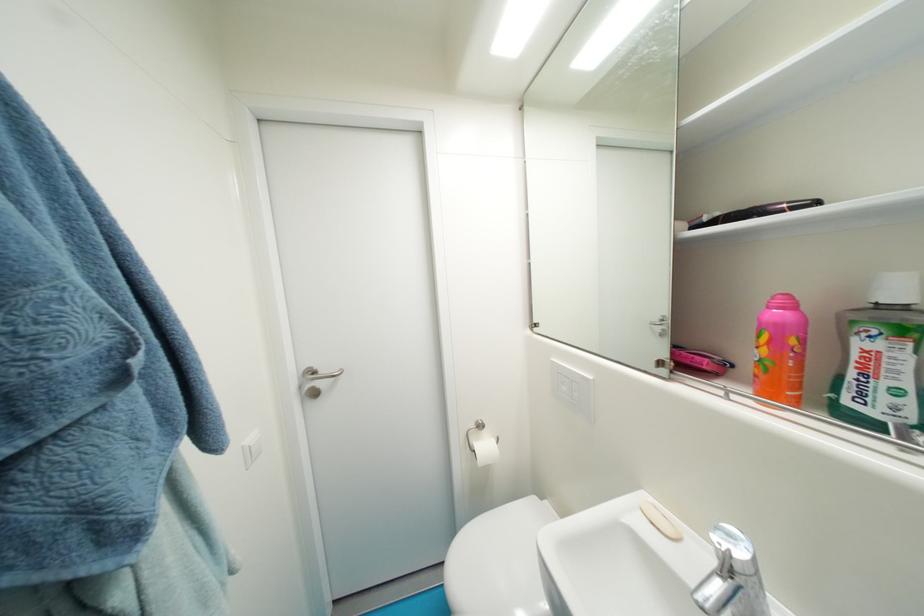
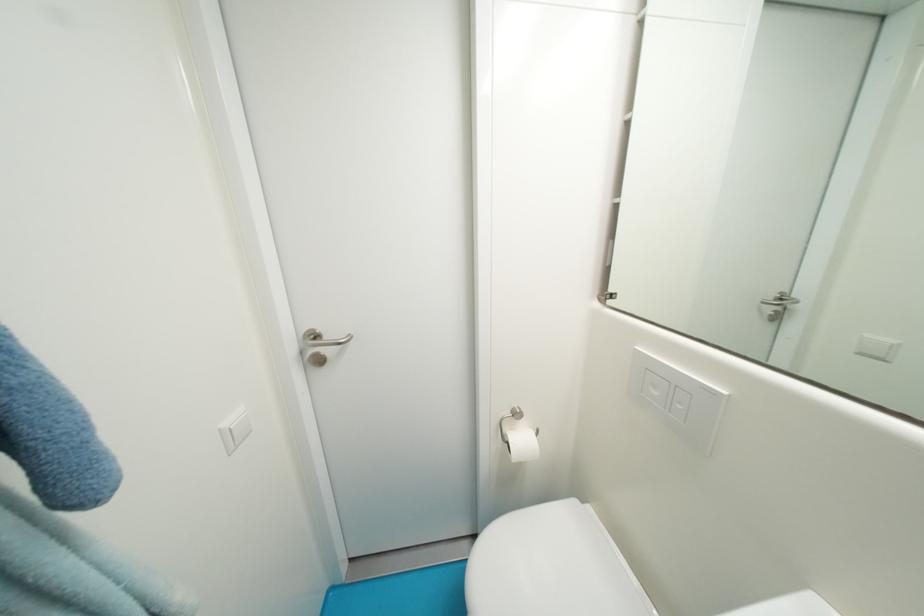
Find the pixel in the second image that matches (x=570, y=390) in the first image.

(662, 395)